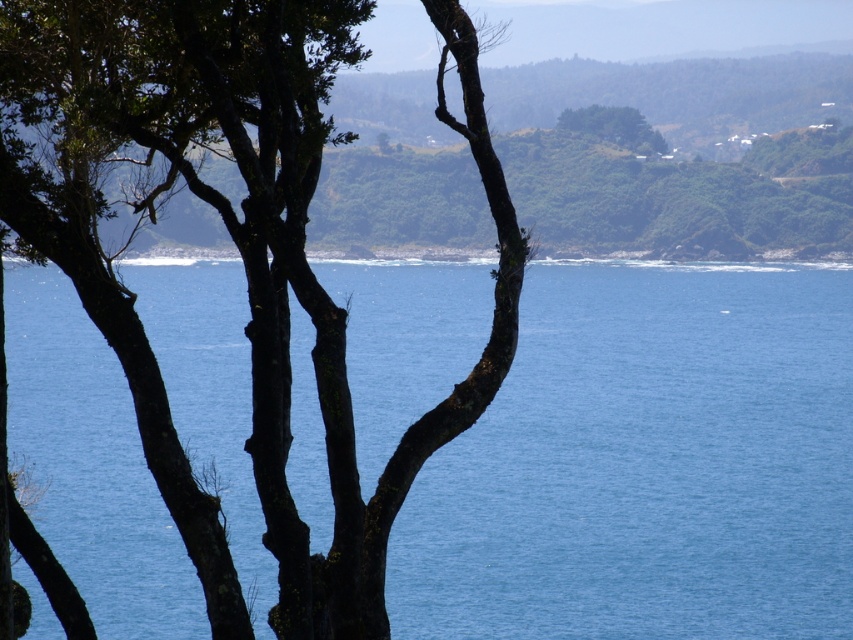
Does blue water at center have a greater width compared to green rough bark tree at left?

Yes, blue water at center is wider than green rough bark tree at left.

Does point (202, 381) come behind point (108, 316)?

Yes, point (202, 381) is behind point (108, 316).

Who is more distant from viewer, (561, 492) or (131, 132)?

Point (561, 492)

Locate an element on the screen. blue water at center is located at coordinates (647, 465).

Does blue water at center come in front of green leafy tree at upper center?

Yes, blue water at center is closer to the viewer.

Between point (479, 497) and point (608, 108), which one is positioned behind?

Point (608, 108)

At what (x,y) coordinates should I click in order to perform the action: click on blue water at center. Please return your answer as a coordinate pair (x, y). The image size is (853, 640). Looking at the image, I should click on (647, 465).

Is point (231, 596) less distant than point (572, 125)?

Yes.

Between green rough bark tree at left and green leafy tree at upper center, which one appears on the left side from the viewer's perspective?

From the viewer's perspective, green rough bark tree at left appears more on the left side.

Which is behind, point (68, 168) or point (659, 145)?

Point (659, 145)

Locate an element on the screen. This screenshot has width=853, height=640. green rough bark tree at left is located at coordinates (238, 250).